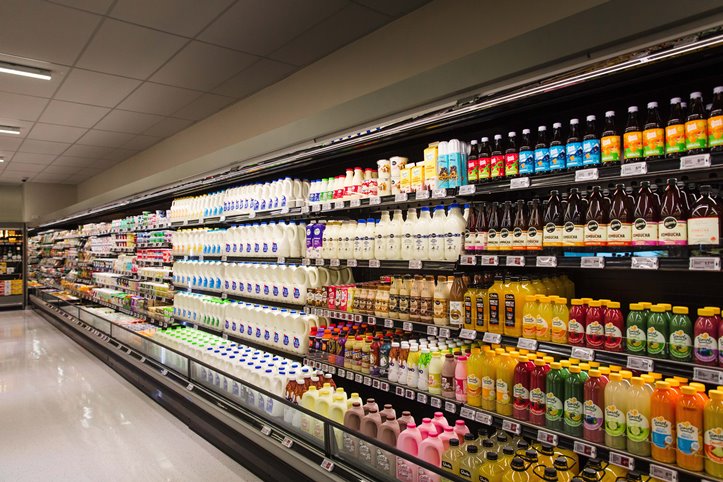
Identify the location of shelves of juice. This screenshot has height=482, width=723. (523, 462), (585, 394), (591, 322).